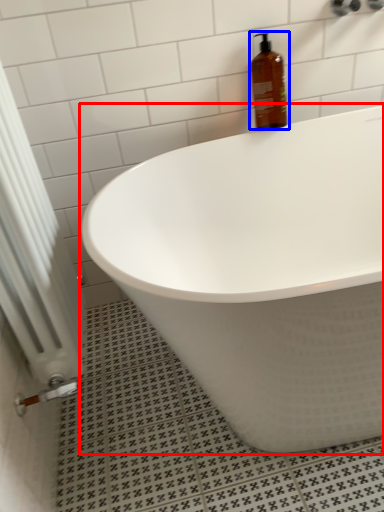
Question: Which point is closer to the camera, bathtub (highlighted by a red box) or bottle (highlighted by a blue box)?

Choices:
 (A) bathtub
 (B) bottle

Answer: (A)